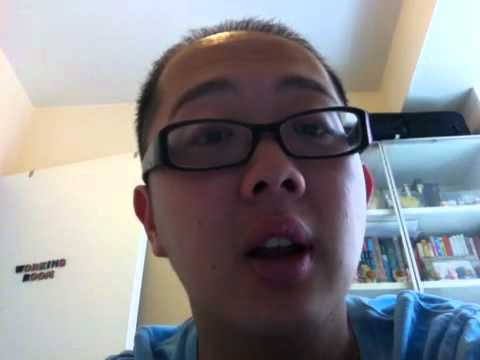
At what (x,y) coordinates should I click in order to perform the action: click on book case. Please return your answer as a coordinate pair (x, y). The width and height of the screenshot is (480, 360). Looking at the image, I should click on (433, 150).